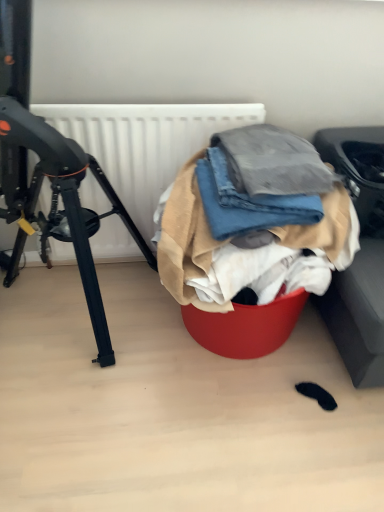
Locate an element on the screen. This screenshot has width=384, height=512. unoccupied area in front of black matte tripod at left is located at coordinates (94, 432).